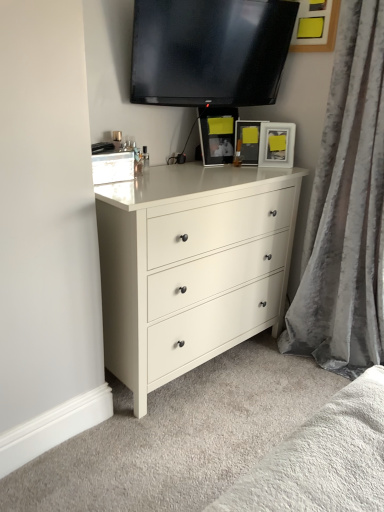
Question: Could you tell me if matte black picture frame at center, which is the second picture frame from left to right, is facing black glossy tv at upper center?

Choices:
 (A) no
 (B) yes

Answer: (A)

Question: Is matte black picture frame at center, the second picture frame in the right-to-left sequence, positioned before black glossy tv at upper center?

Choices:
 (A) yes
 (B) no

Answer: (B)

Question: Does matte black picture frame at center, which is the second picture frame from left to right, have a larger size compared to black glossy tv at upper center?

Choices:
 (A) no
 (B) yes

Answer: (A)

Question: From a real-world perspective, is matte black picture frame at center, which is the second picture frame from left to right, physically below black glossy tv at upper center?

Choices:
 (A) no
 (B) yes

Answer: (B)

Question: Is matte black picture frame at center, the second picture frame in the right-to-left sequence, looking in the opposite direction of black glossy tv at upper center?

Choices:
 (A) no
 (B) yes

Answer: (A)

Question: Would you say matte black picture frame at center, the second picture frame in the right-to-left sequence, is outside black glossy tv at upper center?

Choices:
 (A) no
 (B) yes

Answer: (B)

Question: Is matte black picture frame at upper center, marked as the first picture frame in a left-to-right arrangement, next to black glossy tv at upper center?

Choices:
 (A) yes
 (B) no

Answer: (B)

Question: Considering the relative sizes of matte black picture frame at upper center, marked as the first picture frame in a left-to-right arrangement, and black glossy tv at upper center in the image provided, is matte black picture frame at upper center, marked as the first picture frame in a left-to-right arrangement, thinner than black glossy tv at upper center?

Choices:
 (A) yes
 (B) no

Answer: (A)

Question: Is matte black picture frame at upper center, marked as the first picture frame in a left-to-right arrangement, completely or partially outside of black glossy tv at upper center?

Choices:
 (A) yes
 (B) no

Answer: (A)

Question: Does matte black picture frame at upper center, marked as the first picture frame in a left-to-right arrangement, have a lesser height compared to black glossy tv at upper center?

Choices:
 (A) no
 (B) yes

Answer: (B)

Question: Does matte black picture frame at upper center, which ranks as the 3th picture frame in right-to-left order, have a smaller size compared to black glossy tv at upper center?

Choices:
 (A) yes
 (B) no

Answer: (A)

Question: Is matte black picture frame at upper center, marked as the first picture frame in a left-to-right arrangement, at the left side of black glossy tv at upper center?

Choices:
 (A) no
 (B) yes

Answer: (A)

Question: Is matte black picture frame at upper right, the 1th picture frame viewed from the right, not close to matte white dresser at center?

Choices:
 (A) no
 (B) yes

Answer: (A)